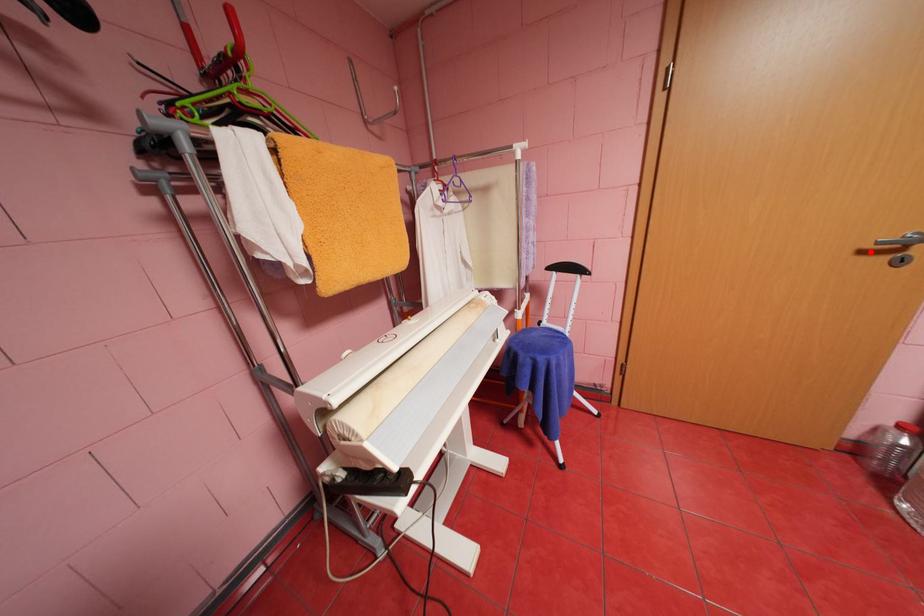
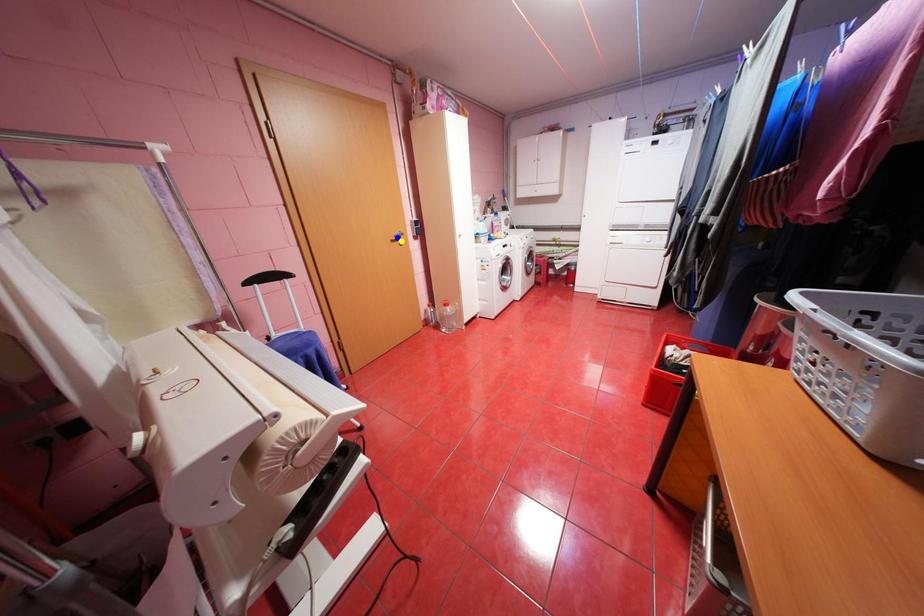
Question: I am providing you with two images of the same scene from different viewpoints. A red point is marked on the first image. You are given multiple points on the second image. Which spot in image 2 lines up with the point in image 1?

Choices:
 (A) green point
 (B) blue point
 (C) yellow point

Answer: (C)